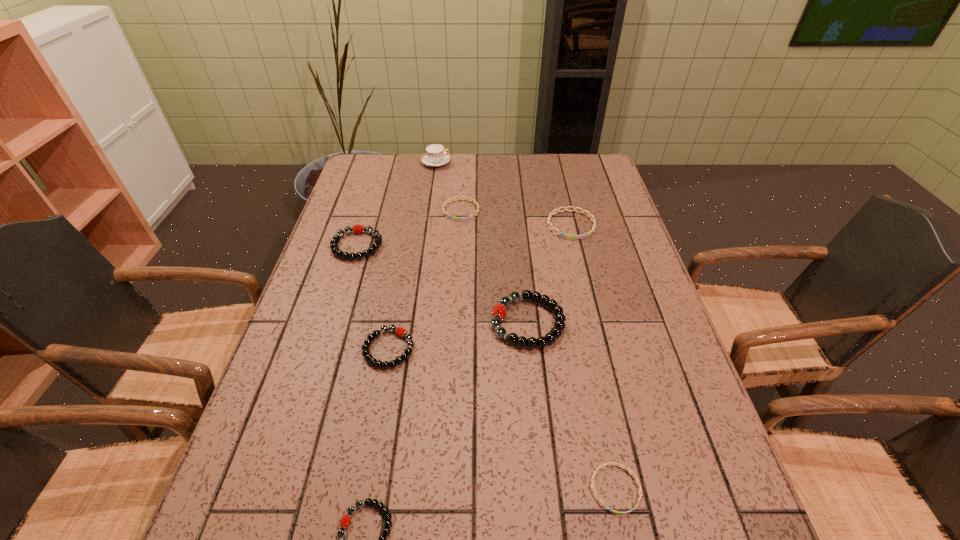
Find the location of a particular element. object that is at the right edge is located at coordinates (568, 236).

This screenshot has width=960, height=540. I want to click on vacant area at the far edge, so click(x=482, y=185).

In the image, there is a desktop. At what (x,y) coordinates should I click in order to perform the action: click on free space at the left edge. Please return your answer as a coordinate pair (x, y). Looking at the image, I should click on (324, 302).

Identify the location of free spot at the right edge of the desktop. (682, 507).

I want to click on vacant space at the far left corner of the desktop, so click(387, 160).

What are the coordinates of `vacant space that's between the biggest blue bracelet and the third biggest black bracelet` in the screenshot? It's located at (480, 287).

Find the location of a particular element. blank region between the tallest bracelet and the third biggest black bracelet is located at coordinates (458, 335).

Identify the location of blank region between the third tallest object and the second tallest object. (443, 284).

This screenshot has width=960, height=540. I want to click on vacant point located between the farthest black bracelet and the biggest blue bracelet, so click(464, 235).

Find the location of a particular element. vacant region between the fourth bracelet from right to left and the shortest bracelet is located at coordinates (538, 349).